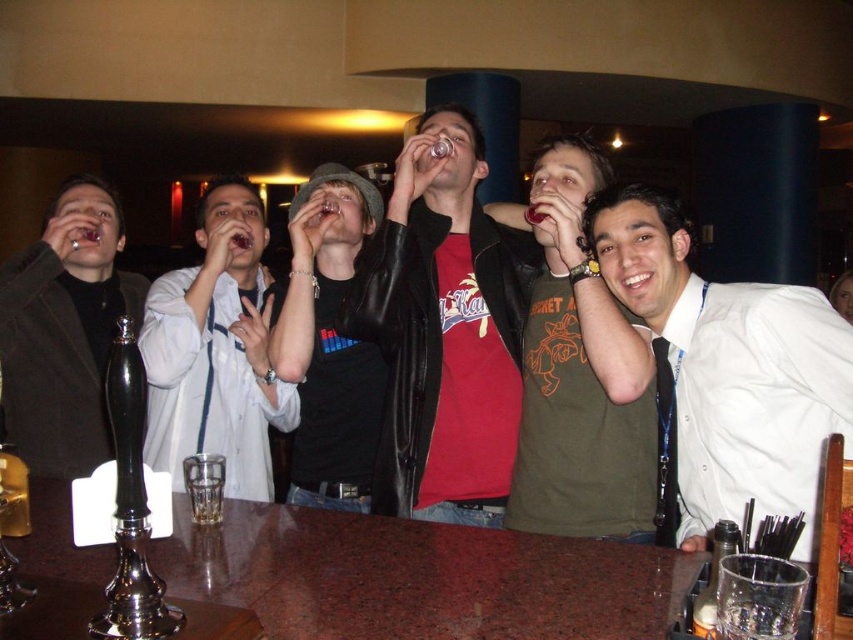
You are standing at the entrance of the bar and want to greet the person wearing the leather jacket at center. In which direction should you walk to reach them?

The leather jacket at center is located at point coordinates, so you should walk towards the center of the bar to reach the person wearing it.

In the scene shown: You are a bartender who needs to deliver a drink to the person wearing the white shirt at center and the person wearing the matte black jacket at left. Which customer should you approach first if you start from the left side of the bar?

You should approach the matte black jacket at left first because the white shirt at center is to the right of the matte black jacket at left, meaning the matte black jacket at left is closer to the left side of the bar.